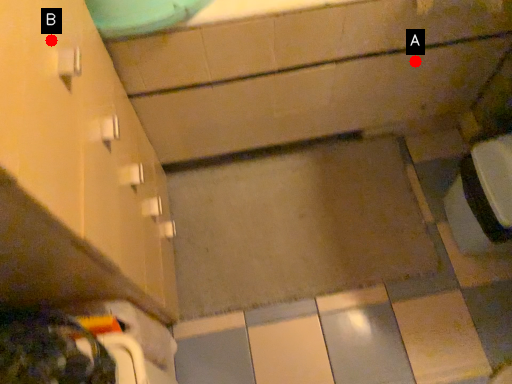
Question: Two points are circled on the image, labeled by A and B beside each circle. Which point appears closest to the camera in this image?

Choices:
 (A) A is closer
 (B) B is closer

Answer: (B)